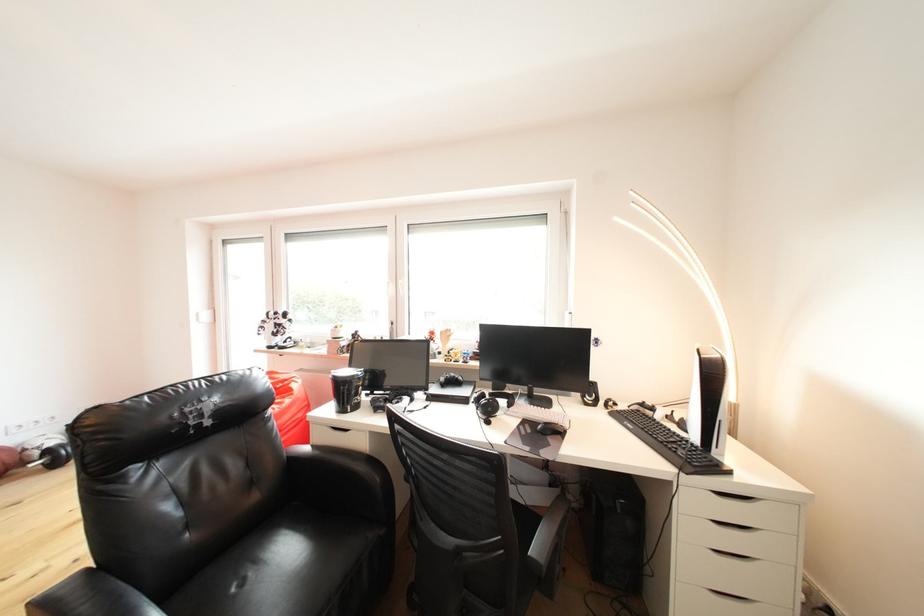
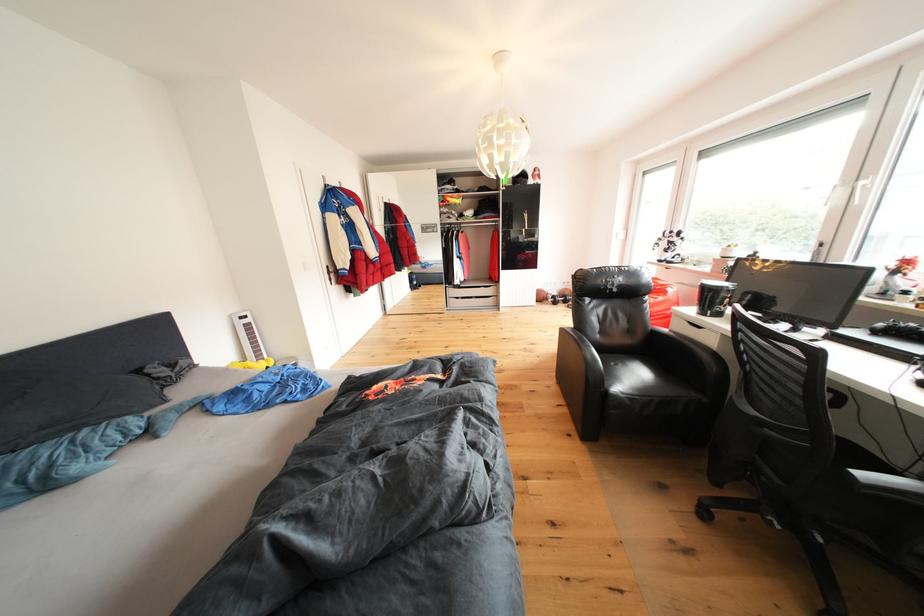
The point at (57, 456) is marked in the first image. Where is the corresponding point in the second image?

(563, 302)